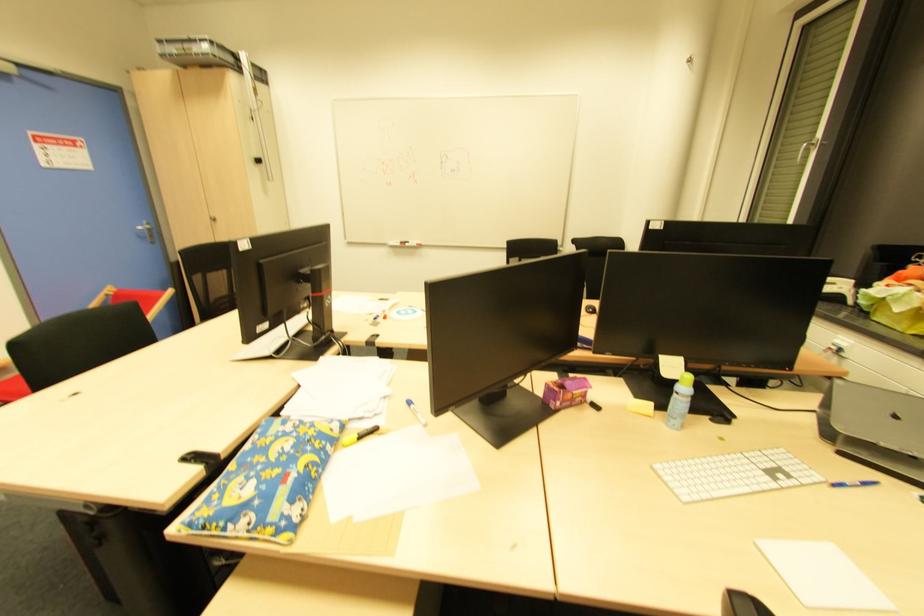
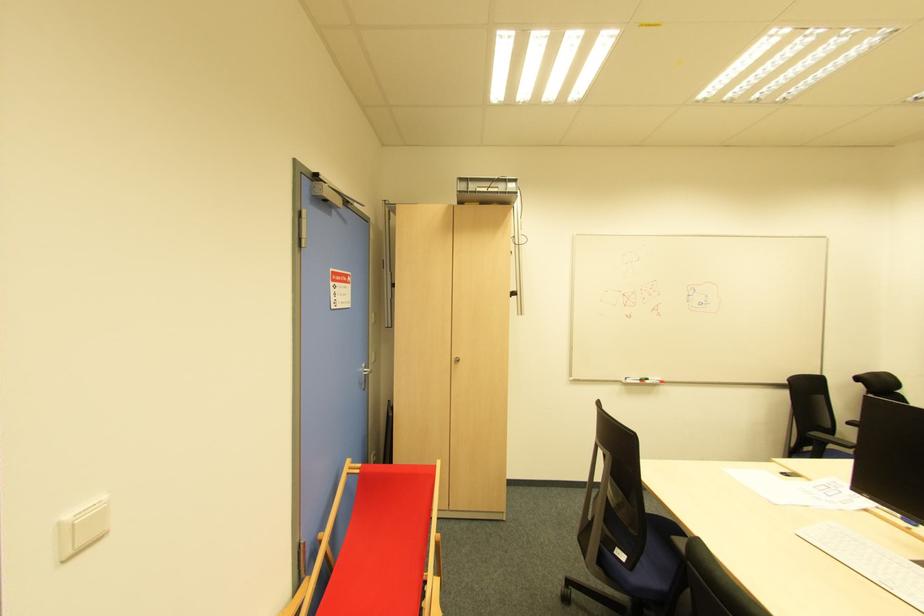
Locate, in the second image, the point that corresponds to point (112, 299) in the first image.

(357, 477)